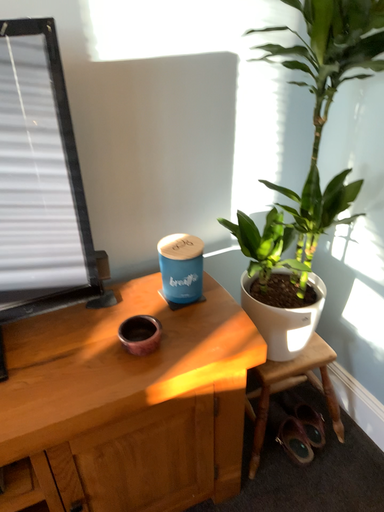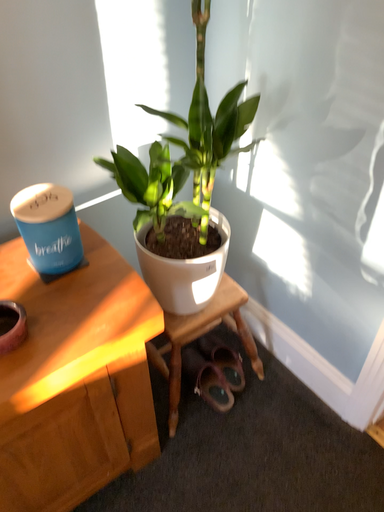
Question: How did the camera likely rotate when shooting the video?

Choices:
 (A) rotated downward
 (B) rotated upward

Answer: (A)